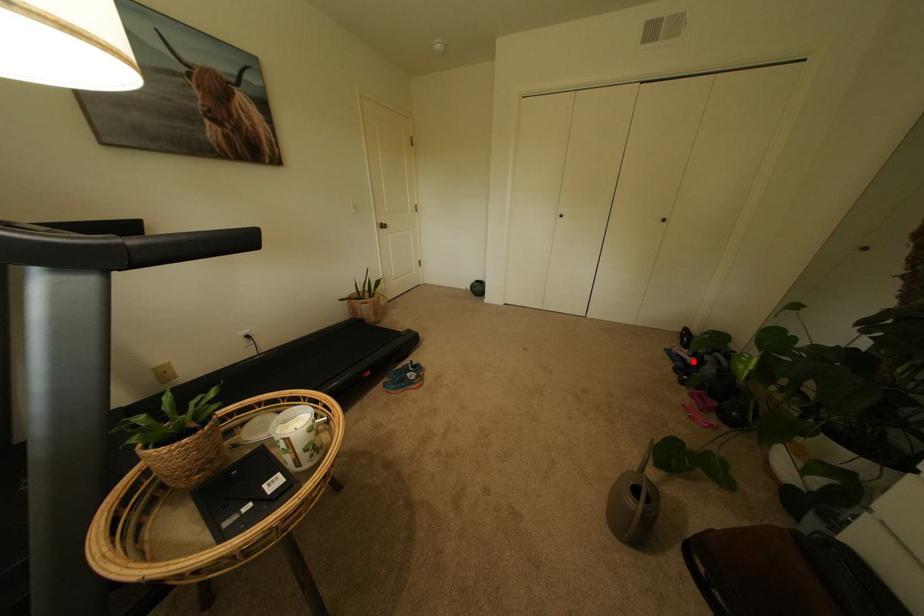
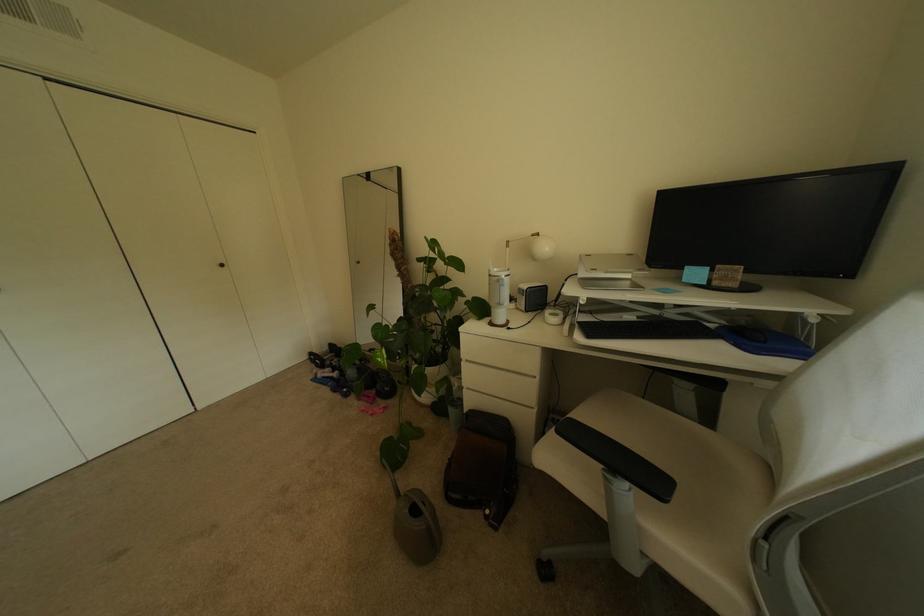
Find the pixel in the second image that matches the highlighted location in the first image.

(341, 379)